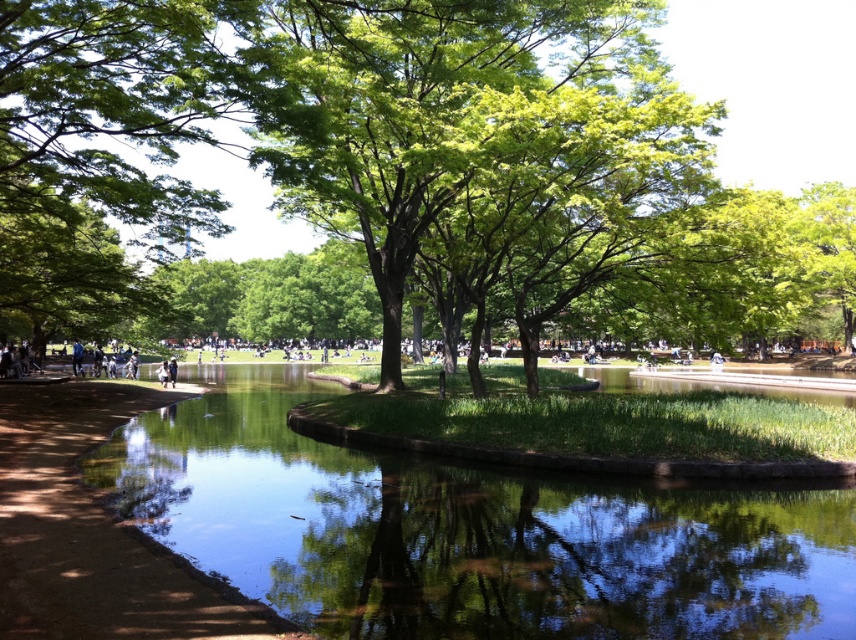
You are a park visitor who wants to walk along the dirt path at lower left without getting your shoes dirty. Is the green leafy tree at center blocking your path?

The green leafy tree at center is positioned over the dirt path at lower left, so its branches or leaves might be obstructing the path, making it difficult to walk without getting shoes dirty.

You are standing at the edge of the dirt path at lower left and want to see the green leafy tree at center. Can you see the tree clearly from your position?

The dirt path at lower left is behind green leafy tree at center, so you cannot see the tree clearly from your position as the tree is blocking your view.

In the scene shown: You are standing at the park entrance and want to take a photo of the green leafy tree at left. If your camera has a maximum focus range of 40 feet, will you need to move closer to capture the tree clearly?

The green leafy tree at left is 41.70 feet away from you. Since your camera can only focus up to 40 feet, you need to move closer to ensure the tree is in focus.